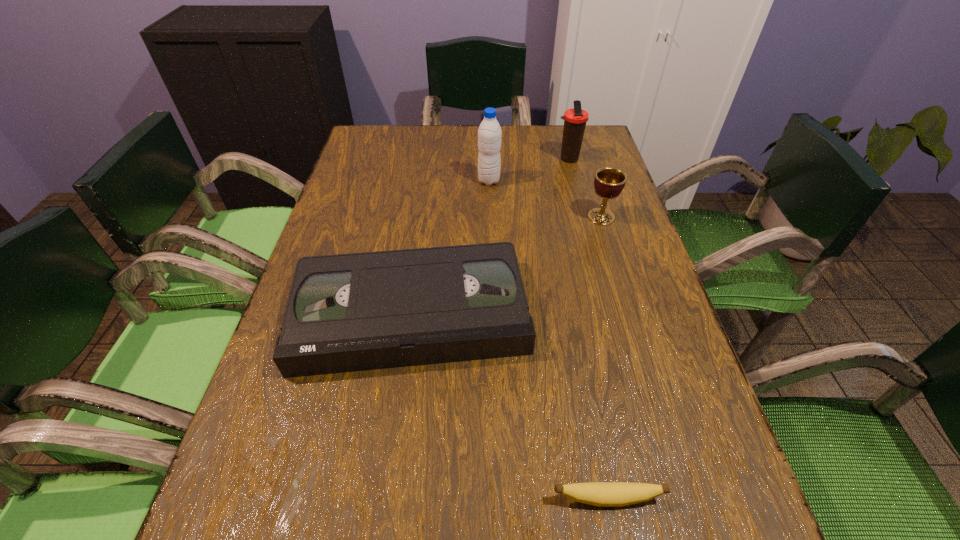
The width and height of the screenshot is (960, 540). I want to click on the tallest object, so click(489, 133).

Find the location of a particular element. Image resolution: width=960 pixels, height=540 pixels. the fourth nearest object is located at coordinates (489, 133).

Identify the location of the fourth shortest object. (575, 119).

What are the coordinates of `the farthest object` in the screenshot? It's located at (575, 119).

The width and height of the screenshot is (960, 540). In order to click on the third shortest object in this screenshot , I will do `click(609, 182)`.

Where is `chalice`? chalice is located at coordinates (609, 182).

Where is `videotape`? Image resolution: width=960 pixels, height=540 pixels. videotape is located at coordinates (350, 312).

The image size is (960, 540). Find the location of `the second nearest object`. the second nearest object is located at coordinates (350, 312).

Find the location of a particular element. banana is located at coordinates (604, 494).

Identify the location of the nearest object. [x=604, y=494].